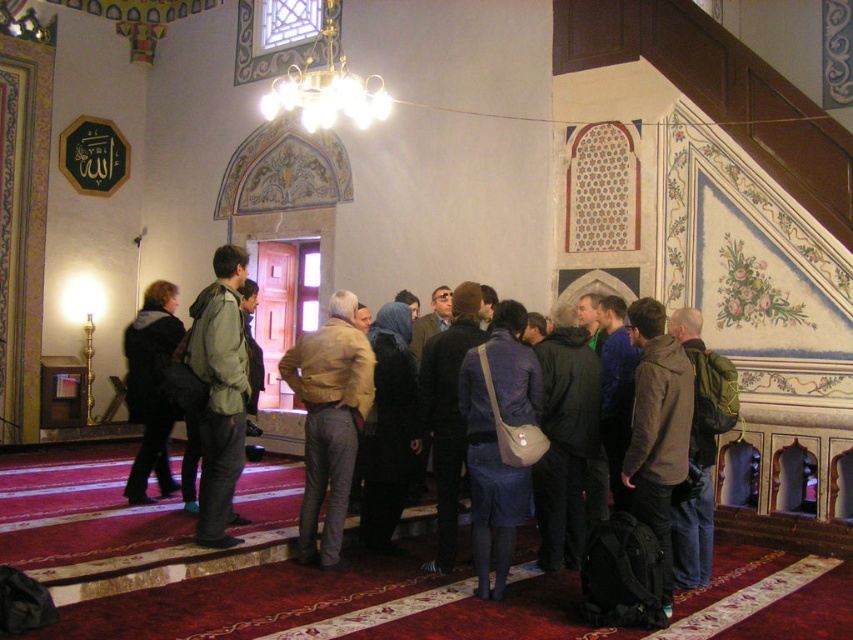
Question: Considering the relative positions of blue fabric dress at center and dark brown leather jacket at center in the image provided, where is blue fabric dress at center located with respect to dark brown leather jacket at center?

Choices:
 (A) left
 (B) right

Answer: (B)

Question: Among these objects, which one is nearest to the camera?

Choices:
 (A) brown leather backpack at center
 (B) green matte jacket at center
 (C) green backpack at center
 (D) blue fabric dress at center

Answer: (A)

Question: Which point appears farthest from the camera in this image?

Choices:
 (A) (682, 385)
 (B) (541, 408)
 (C) (132, 339)

Answer: (C)

Question: Does blue fabric dress at center have a lesser width compared to brown leather backpack at center?

Choices:
 (A) no
 (B) yes

Answer: (A)

Question: Is dark gray jacket at center below brown leather backpack at center?

Choices:
 (A) no
 (B) yes

Answer: (A)

Question: Based on their relative distances, which object is nearer to the green matte jacket at center?

Choices:
 (A) gold metallic chandelier at upper center
 (B) brown leather backpack at center
 (C) green backpack at center
 (D) tan leather jacket at center

Answer: (D)